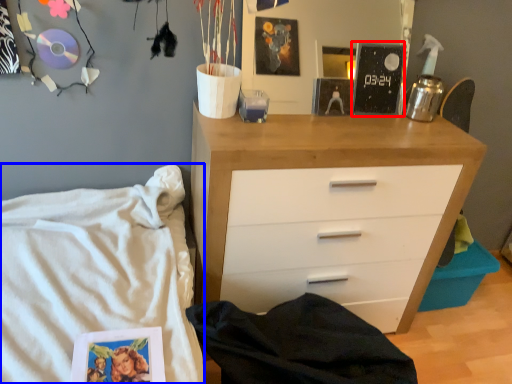
Question: Which point is closer to the camera, magazine (highlighted by a red box) or bed (highlighted by a blue box)?

Choices:
 (A) magazine
 (B) bed

Answer: (B)